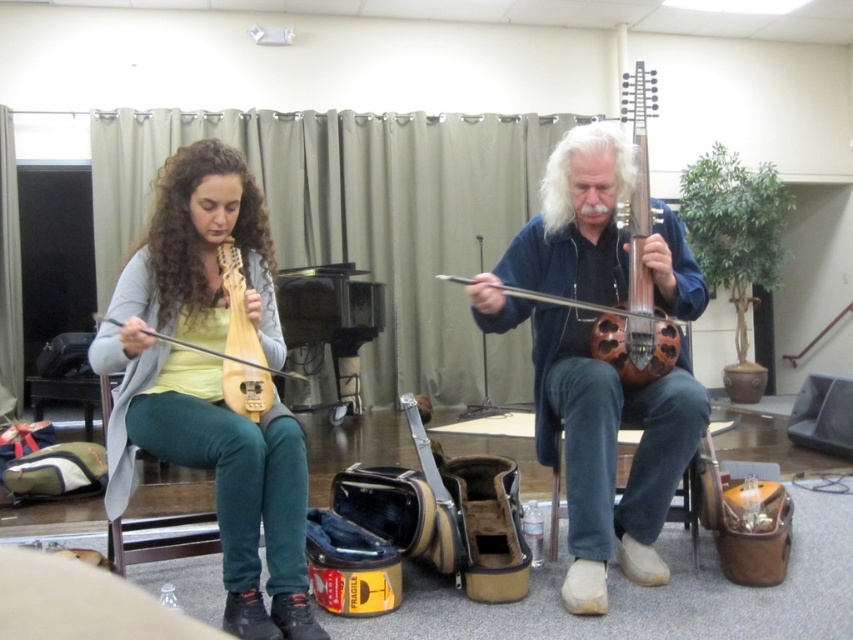
Measure the distance between wooden violin at center and matte wood violin at left.

38.69 inches

Is wooden violin at center behind matte wood violin at left?

Yes, wooden violin at center is behind matte wood violin at left.

This screenshot has width=853, height=640. What are the coordinates of `wooden violin at center` in the screenshot? It's located at (592, 369).

Is wooden cello at right further to the viewer compared to matte wood violin at left?

Yes.

Which is more to the right, wooden cello at right or matte wood violin at left?

From the viewer's perspective, wooden cello at right appears more on the right side.

Between point (624, 307) and point (231, 362), which one is positioned behind?

The point (624, 307) is behind.

Image resolution: width=853 pixels, height=640 pixels. Find the location of `wooden cello at right`. wooden cello at right is located at coordinates (637, 259).

Can you confirm if matte yellow wood lute at left is positioned above wooden violin at center?

Incorrect, matte yellow wood lute at left is not positioned above wooden violin at center.

Is point (213, 490) behind point (664, 381)?

That is False.

The image size is (853, 640). What are the coordinates of `matte yellow wood lute at left` in the screenshot? It's located at (210, 384).